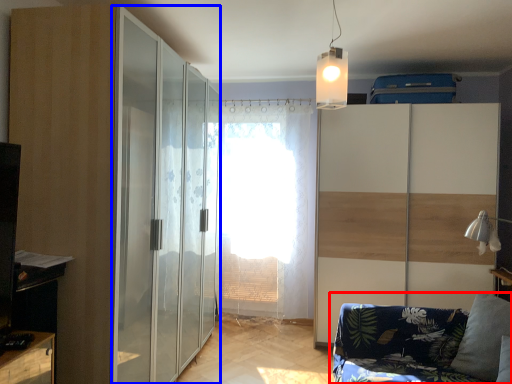
Question: Which object is closer to the camera taking this photo, studio couch (highlighted by a red box) or screen door (highlighted by a blue box)?

Choices:
 (A) studio couch
 (B) screen door

Answer: (A)